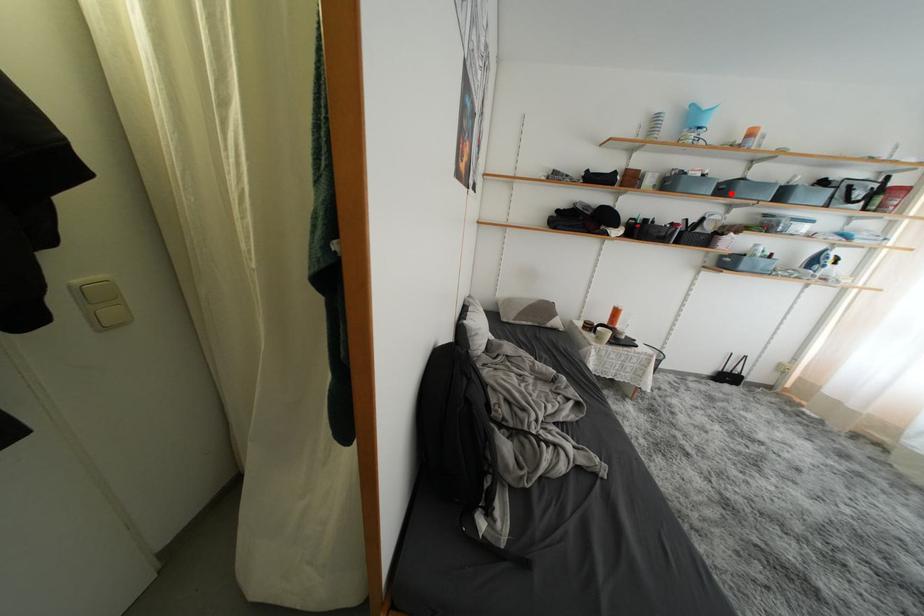
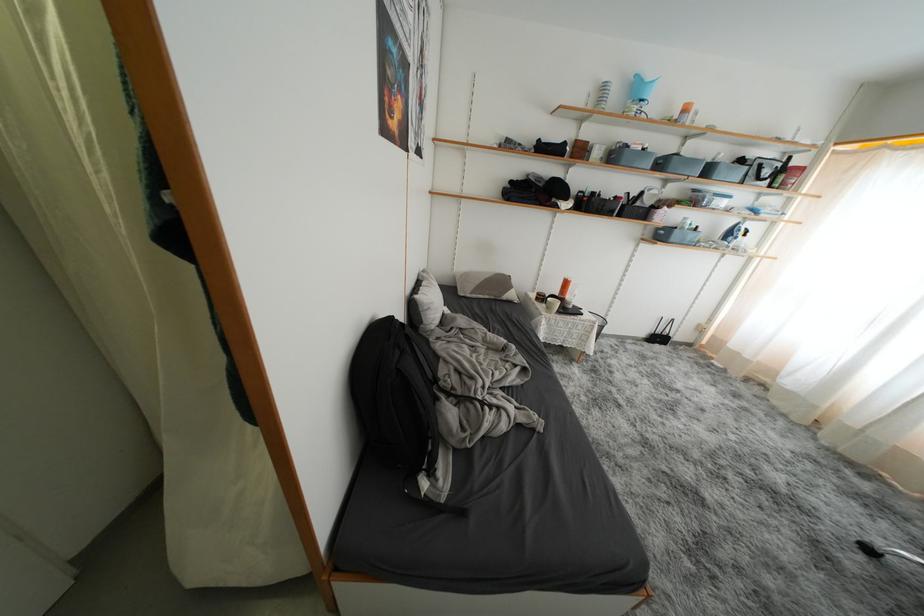
Where in the second image is the point corresponding to the highlighted location from the first image?

(667, 168)